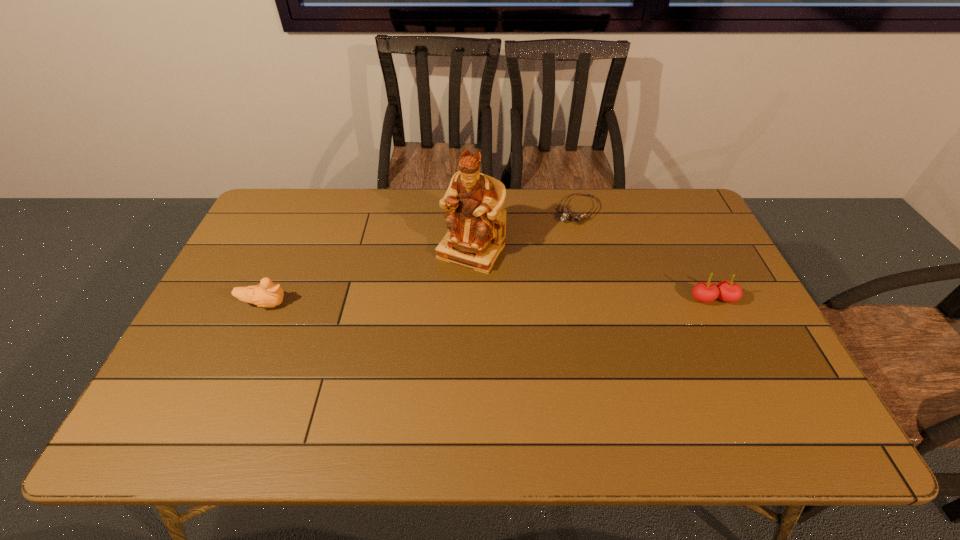
Find the location of a particular element. the leftmost object is located at coordinates (267, 294).

This screenshot has width=960, height=540. What are the coordinates of `the rightmost object` in the screenshot? It's located at (728, 291).

Find the location of `the farthest object`. the farthest object is located at coordinates (577, 217).

Locate an element on the screen. This screenshot has width=960, height=540. goggles is located at coordinates [577, 217].

What are the coordinates of `the second farthest object` in the screenshot? It's located at (476, 220).

The height and width of the screenshot is (540, 960). Find the location of `the third object from right to left`. the third object from right to left is located at coordinates (476, 220).

Locate an element on the screen. This screenshot has height=540, width=960. free space located on the face of the duckling is located at coordinates (340, 304).

You are a GUI agent. You are given a task and a screenshot of the screen. Output one action in this format:
    pyautogui.click(x=<x>, y=<y>)
    Task: Click on the vacant space located on the left of the cherry
    The image size is (960, 540).
    Given the screenshot: What is the action you would take?
    pyautogui.click(x=663, y=300)

Find the location of a particular element. This screenshot has height=540, width=960. free spot located 0.200m on the front lenses and sides of the farthest object is located at coordinates (545, 260).

Where is `vacant area situated 0.400m on the front lenses and sides of the farthest object`? The width and height of the screenshot is (960, 540). vacant area situated 0.400m on the front lenses and sides of the farthest object is located at coordinates (516, 304).